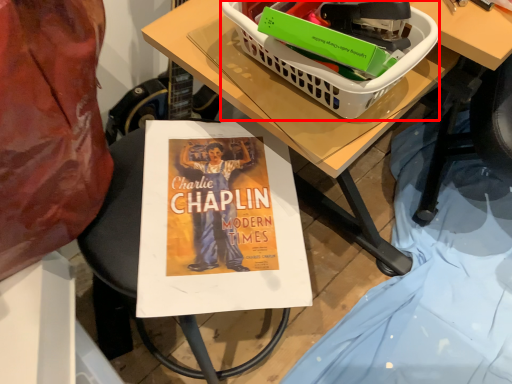
Question: From the image's perspective, where is basket (annotated by the red box) located relative to table?

Choices:
 (A) below
 (B) above

Answer: (B)